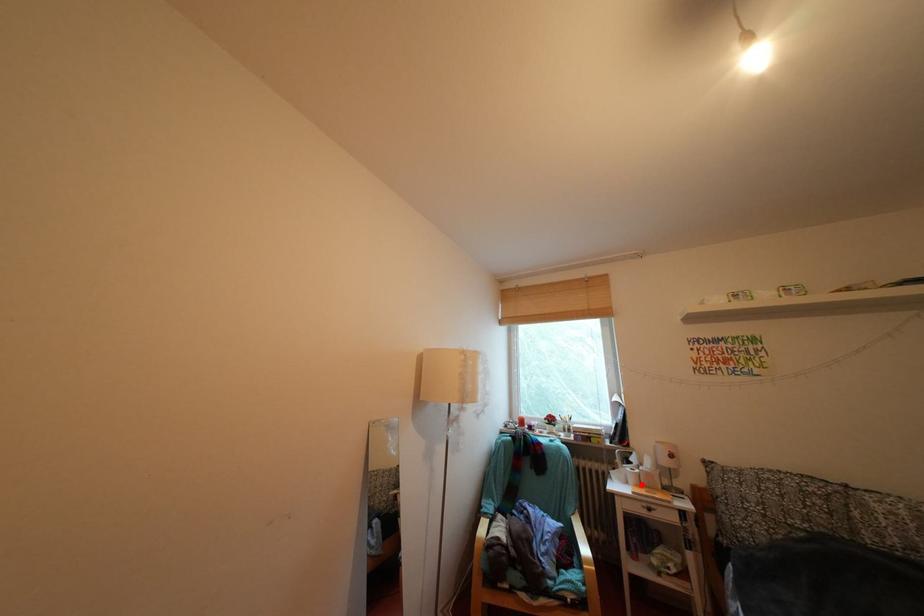
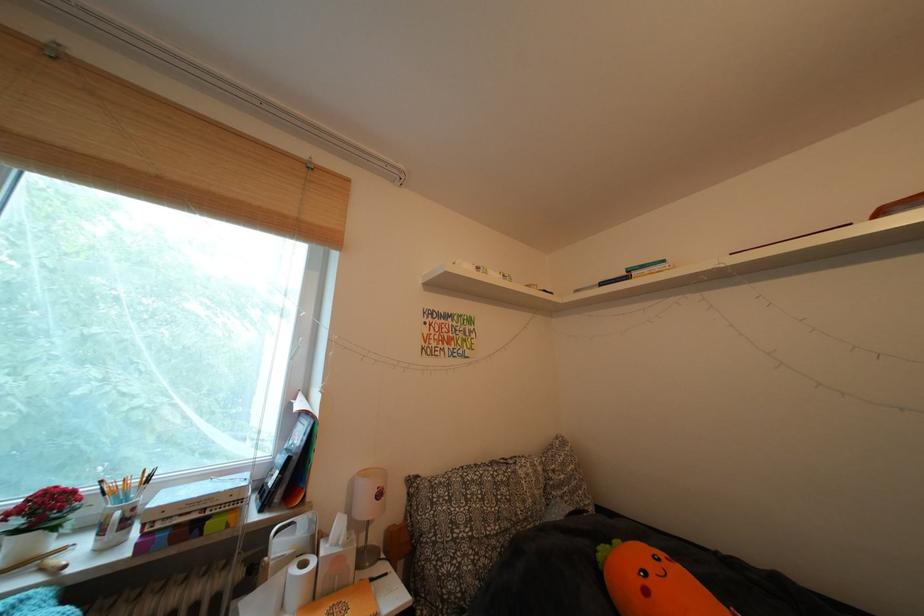
Where in the second image is the point corresponding to the highlighted location from the first image?

(306, 602)